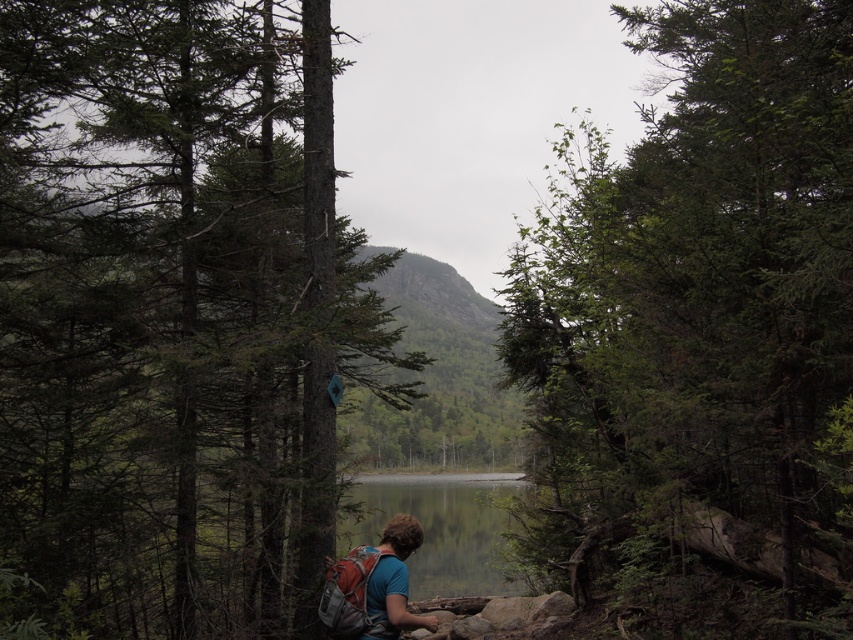
Question: Can you confirm if green leafy tree at center is positioned to the left of clear water at center?

Choices:
 (A) yes
 (B) no

Answer: (B)

Question: Can you confirm if green matte tree at center is bigger than clear water at center?

Choices:
 (A) no
 (B) yes

Answer: (B)

Question: Which object appears closest to the camera in this image?

Choices:
 (A) green leafy tree at center
 (B) matte blue shirt at lower center
 (C) clear water at center

Answer: (A)

Question: Which object is farther from the camera taking this photo?

Choices:
 (A) green matte tree at center
 (B) green leafy tree at center
 (C) matte blue shirt at lower center

Answer: (C)

Question: Is clear water at center further to the viewer compared to matte blue shirt at lower center?

Choices:
 (A) no
 (B) yes

Answer: (B)

Question: Which of the following is the farthest from the observer?

Choices:
 (A) (178, 378)
 (B) (357, 621)
 (C) (497, 541)
 (D) (675, 200)

Answer: (C)